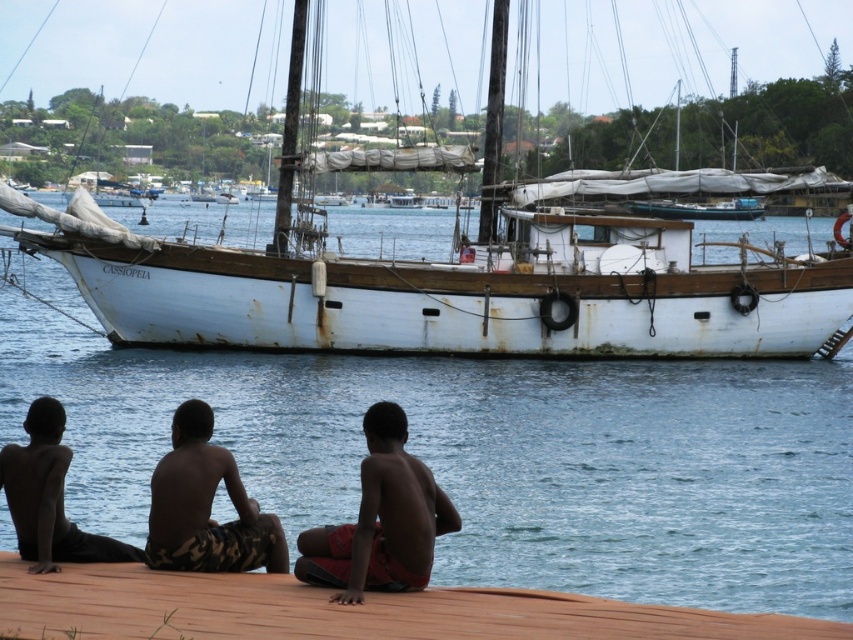
Can you confirm if rusty wooden sailboat at center is positioned above red fabric shorts at lower center?

Yes, rusty wooden sailboat at center is above red fabric shorts at lower center.

Does point (132, 285) come behind point (415, 582)?

Yes, it is.

Which is in front, point (428, 113) or point (378, 492)?

Positioned in front is point (378, 492).

Find the location of `rusty wooden sailboat at center`. rusty wooden sailboat at center is located at coordinates (461, 260).

How distant is rusty wooden sailboat at center from dark skin/soft skin child at lower left?

rusty wooden sailboat at center and dark skin/soft skin child at lower left are 65.69 meters apart from each other.

Does rusty wooden sailboat at center have a smaller size compared to dark skin/soft skin child at lower left?

No.

Where is `rusty wooden sailboat at center`? rusty wooden sailboat at center is located at coordinates (461, 260).

Locate an element on the screen. Image resolution: width=853 pixels, height=640 pixels. rusty wooden sailboat at center is located at coordinates (461, 260).

Is camo shorts at lower center wider than dark skin/soft skin child at lower left?

Yes.

Can you confirm if camo shorts at lower center is positioned to the left of dark skin/soft skin child at lower left?

No, camo shorts at lower center is not to the left of dark skin/soft skin child at lower left.

Is point (206, 547) positioned in front of point (38, 468)?

Yes, point (206, 547) is closer to viewer.

At what (x,y) coordinates should I click in order to perform the action: click on camo shorts at lower center. Please return your answer as a coordinate pair (x, y). The width and height of the screenshot is (853, 640). Looking at the image, I should click on (206, 506).